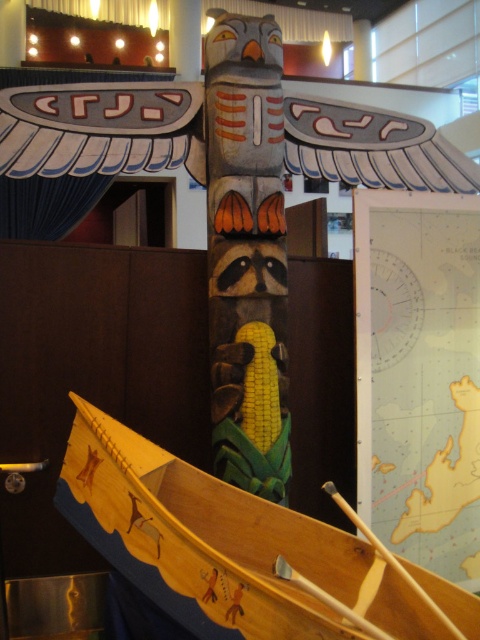
You are an interior designer planning to move a large potted plant into the space. The wooden canoe at center and the wooden at lower center are both in the way. Which object should you move to create more space on the right side?

To create more space on the right side, you should move the wooden canoe at center, which is positioned on the left side of the wooden at lower center.

Consider the image. You are standing in front of the totem pole and want to pick up the closest wooden object. Which one should you choose between the wooden canoe at center and the wooden at lower center?

The wooden canoe at center is closer to the viewer than the wooden at lower center, so you should choose the wooden canoe at center.